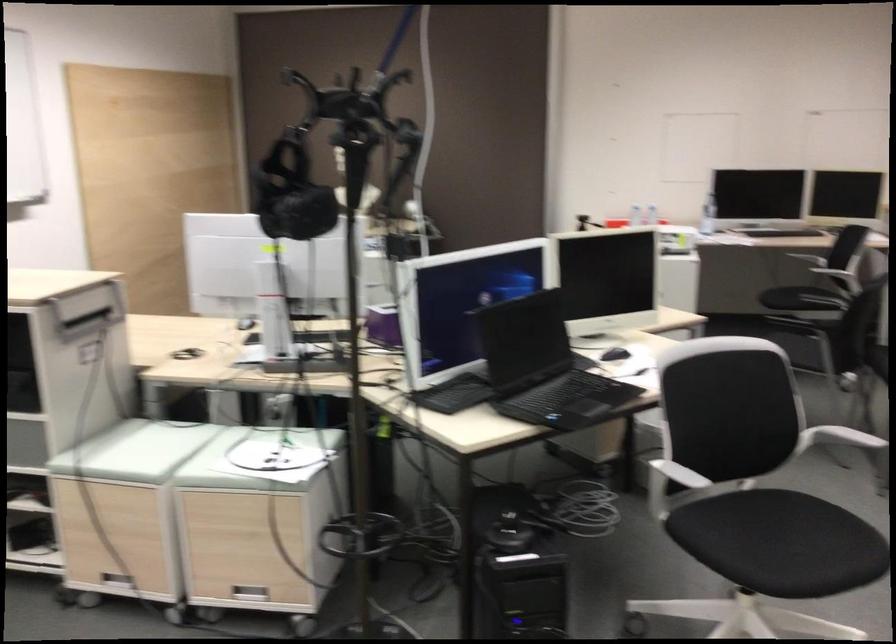
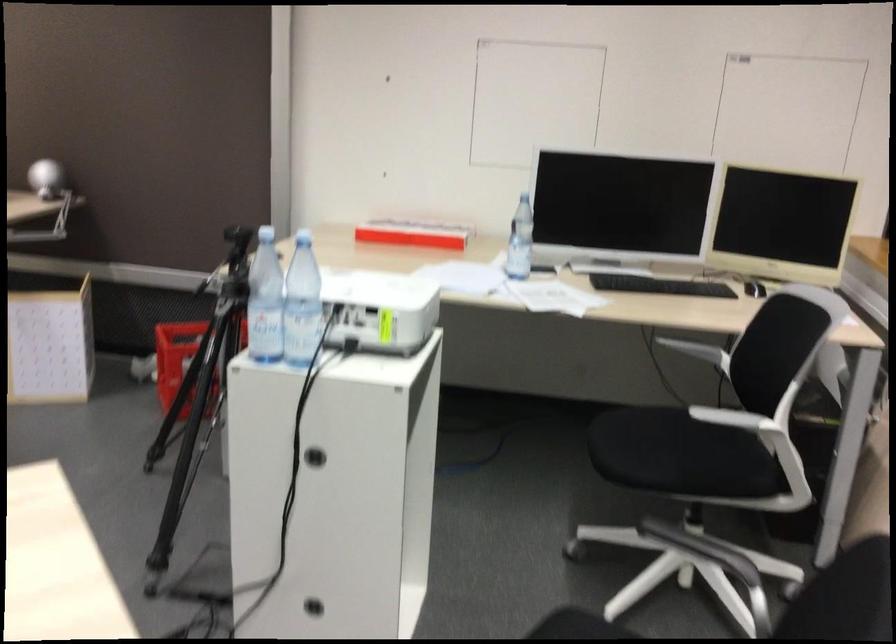
Locate, in the second image, the point that corresponds to pixel 659 204 in the first image.

(412, 234)